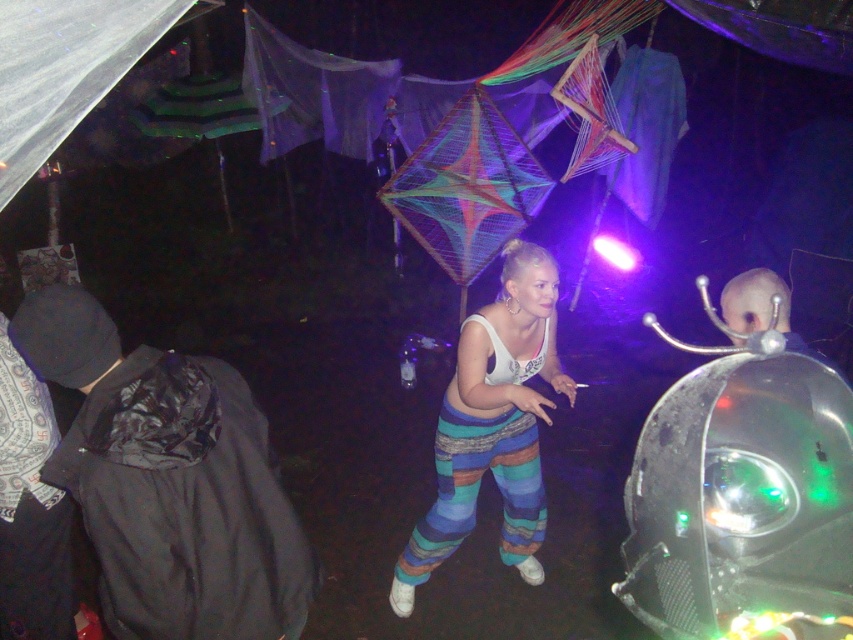
You are at a nighttime festival and need to find the white cotton tank top at center. Which direction should you look relative to the black plastic bag at lower left?

The white cotton tank top at center is to the right of the black plastic bag at lower left.

You are at a festival and need to carry some items. You see a black plastic bag at lower left and a white cotton tank top at center. Which item can hold more items based on their sizes?

The black plastic bag at lower left has a larger width than the white cotton tank top at center, so it can hold more items.